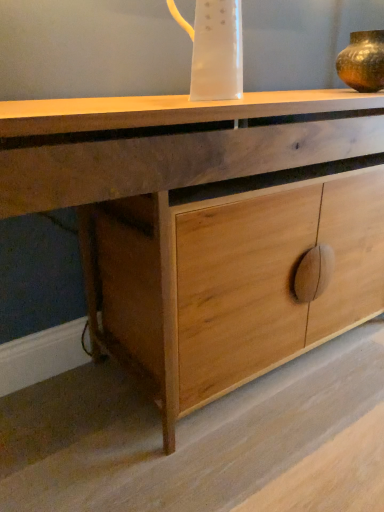
Question: Can you confirm if transparent plastic jug at upper center is positioned to the right of gold metallic vase at upper right?

Choices:
 (A) yes
 (B) no

Answer: (B)

Question: Does transparent plastic jug at upper center have a lesser height compared to gold metallic vase at upper right?

Choices:
 (A) no
 (B) yes

Answer: (A)

Question: Considering the relative sizes of transparent plastic jug at upper center and gold metallic vase at upper right in the image provided, is transparent plastic jug at upper center smaller than gold metallic vase at upper right?

Choices:
 (A) yes
 (B) no

Answer: (A)

Question: Is transparent plastic jug at upper center far from gold metallic vase at upper right?

Choices:
 (A) no
 (B) yes

Answer: (A)

Question: From a real-world perspective, is transparent plastic jug at upper center under gold metallic vase at upper right?

Choices:
 (A) yes
 (B) no

Answer: (B)

Question: Is gold metallic vase at upper right situated inside natural wood cabinet at center or outside?

Choices:
 (A) outside
 (B) inside

Answer: (A)

Question: In terms of width, does gold metallic vase at upper right look wider or thinner when compared to natural wood cabinet at center?

Choices:
 (A) wide
 (B) thin

Answer: (B)

Question: Is point (354, 79) closer or farther from the camera than point (291, 110)?

Choices:
 (A) farther
 (B) closer

Answer: (A)

Question: Visually, is gold metallic vase at upper right positioned to the left or to the right of natural wood cabinet at center?

Choices:
 (A) right
 (B) left

Answer: (A)

Question: From their relative heights in the image, would you say transparent plastic jug at upper center is taller or shorter than natural wood cabinet at center?

Choices:
 (A) short
 (B) tall

Answer: (A)

Question: Is point (195, 48) closer or farther from the camera than point (1, 194)?

Choices:
 (A) farther
 (B) closer

Answer: (A)

Question: Would you say transparent plastic jug at upper center is inside or outside natural wood cabinet at center?

Choices:
 (A) inside
 (B) outside

Answer: (B)

Question: From a real-world perspective, is transparent plastic jug at upper center positioned above or below natural wood cabinet at center?

Choices:
 (A) below
 (B) above

Answer: (B)

Question: Looking at the image, does natural wood cabinet at center seem bigger or smaller compared to gold metallic vase at upper right?

Choices:
 (A) big
 (B) small

Answer: (A)

Question: Do you think natural wood cabinet at center is within gold metallic vase at upper right, or outside of it?

Choices:
 (A) inside
 (B) outside

Answer: (B)